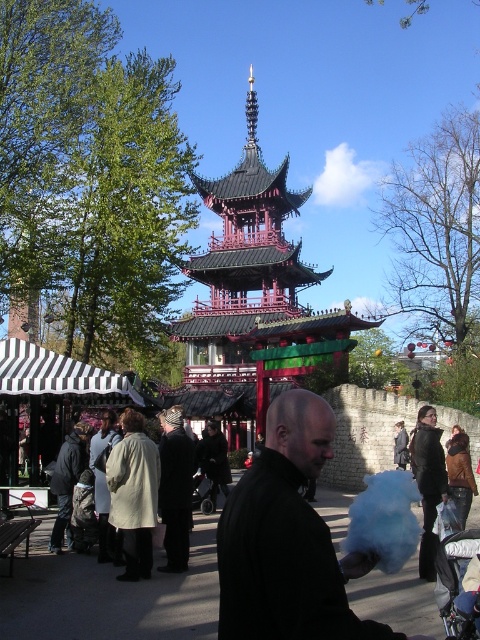
Does black matte cotton candy at center appear under dark gray jacket at center?

Actually, black matte cotton candy at center is above dark gray jacket at center.

Can you confirm if black matte cotton candy at center is smaller than dark gray jacket at center?

Actually, black matte cotton candy at center might be larger than dark gray jacket at center.

Where is `black matte cotton candy at center`? black matte cotton candy at center is located at coordinates (288, 540).

Does reddish-pink wooden pagoda at center have a lesser width compared to dark gray jacket at center?

No, reddish-pink wooden pagoda at center is not thinner than dark gray jacket at center.

Is reddish-pink wooden pagoda at center positioned at the back of dark gray jacket at center?

Yes, reddish-pink wooden pagoda at center is behind dark gray jacket at center.

Does point (219, 378) lie behind point (51, 541)?

Yes, it is behind point (51, 541).

Locate an element on the screen. The width and height of the screenshot is (480, 640). reddish-pink wooden pagoda at center is located at coordinates (252, 298).

Who is taller, reddish-pink wooden pagoda at center or black matte cotton candy at center?

reddish-pink wooden pagoda at center is taller.

Between reddish-pink wooden pagoda at center and black matte cotton candy at center, which one is positioned higher?

reddish-pink wooden pagoda at center is above.

Consider the image. Who is more distant from viewer, (240, 240) or (254, 516)?

The point (240, 240) is behind.

In order to click on reddish-pink wooden pagoda at center in this screenshot , I will do `click(252, 298)`.